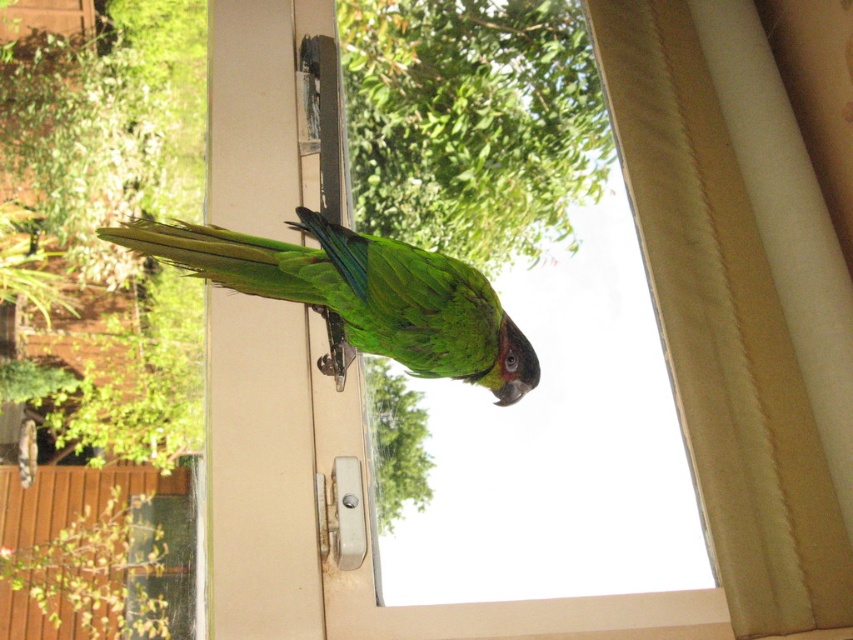
Can you confirm if transparent glass window at center is taller than green matte parrot at center?

Yes.

Can you confirm if transparent glass window at center is positioned below green matte parrot at center?

Yes, transparent glass window at center is below green matte parrot at center.

Where is `transparent glass window at center`? This screenshot has height=640, width=853. transparent glass window at center is located at coordinates (514, 406).

Between transparent glass window at center and beige textured curtain at upper right, which one has less height?

beige textured curtain at upper right

Looking at this image, is transparent glass window at center taller than beige textured curtain at upper right?

Indeed, transparent glass window at center has a greater height compared to beige textured curtain at upper right.

At what (x,y) coordinates should I click in order to perform the action: click on transparent glass window at center. Please return your answer as a coordinate pair (x, y). Looking at the image, I should click on point(514,406).

Is beige textured curtain at upper right shorter than green matte parrot at center?

No.

Is beige textured curtain at upper right further to camera compared to green matte parrot at center?

Yes.

Which is in front, point (641, 70) or point (366, 250)?

Point (366, 250) is in front.

Where is `beige textured curtain at upper right`? Image resolution: width=853 pixels, height=640 pixels. beige textured curtain at upper right is located at coordinates (711, 308).